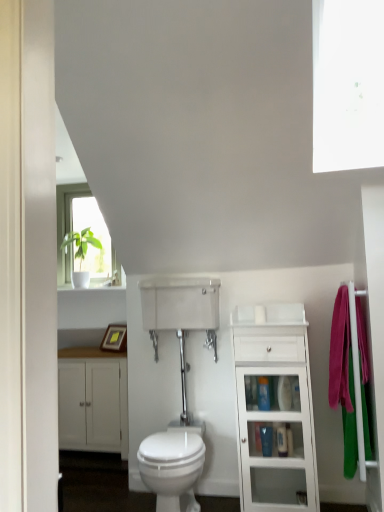
At what (x,y) coordinates should I click in order to perform the action: click on free point above white glossy bidet at center (from a real-world perspective). Please return your answer as a coordinate pair (x, y). The image size is (384, 512). Looking at the image, I should click on (178, 435).